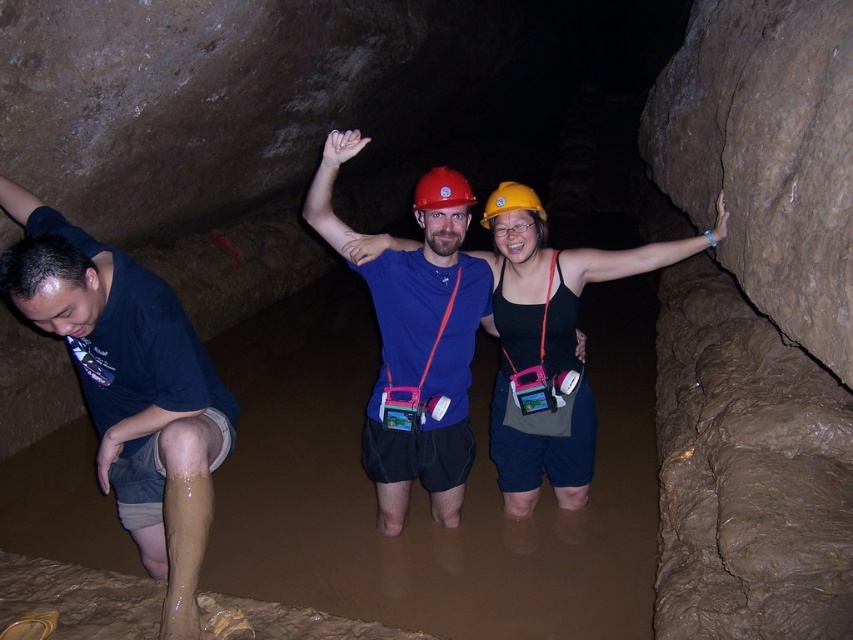
Question: Which object is closer to the camera taking this photo?

Choices:
 (A) red matte helmet at center
 (B) matte black tank top at center

Answer: (A)

Question: Does red matte helmet at center appear on the left side of yellow matte helmet at center?

Choices:
 (A) yes
 (B) no

Answer: (A)

Question: Which point is farther to the camera?

Choices:
 (A) (447, 193)
 (B) (466, 417)

Answer: (B)

Question: Which object appears closest to the camera in this image?

Choices:
 (A) matte blue shirt at center
 (B) matte black tank top at center
 (C) yellow matte helmet at center

Answer: (A)

Question: Is dark blue t-shirt at lower left to the left of red matte helmet at center from the viewer's perspective?

Choices:
 (A) yes
 (B) no

Answer: (A)

Question: Does dark blue t-shirt at lower left come in front of yellow matte helmet at center?

Choices:
 (A) yes
 (B) no

Answer: (A)